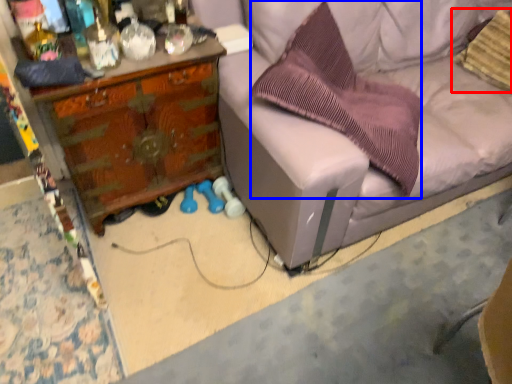
Question: Which object appears closest to the camera in this image, pillow (highlighted by a red box) or pillow (highlighted by a blue box)?

Choices:
 (A) pillow
 (B) pillow

Answer: (B)